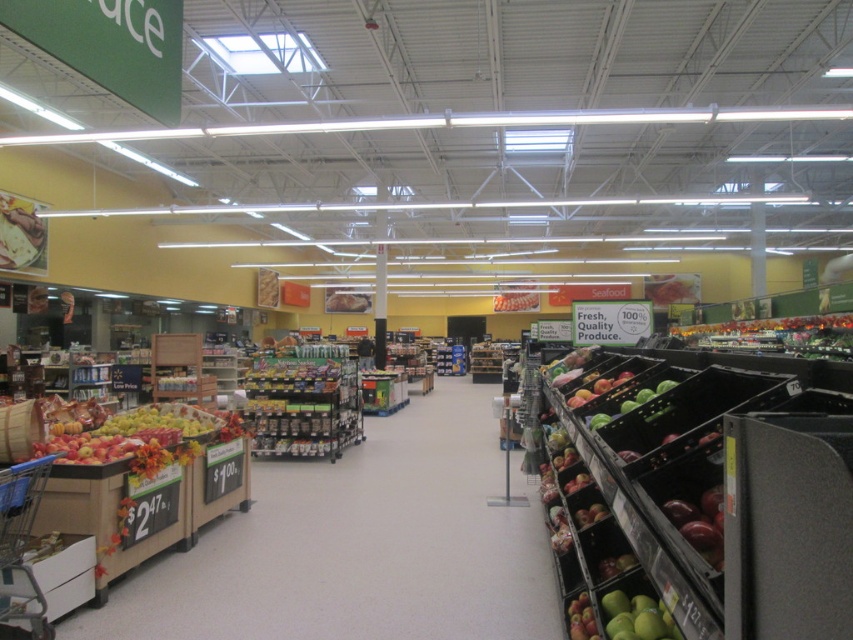
You are standing in the grocery store and see the point marked at coordinates (360, 545). Based on the scene description, what object is this point located on?

The point at coordinates (360, 545) is located on the wooden crate apples at left.

Looking at this image, you are a customer in the grocery store looking for apples. You see a wooden crate apples at left and green matte apples at center. Which one is closer to the entrance of the store?

The wooden crate apples at left is closer to the entrance of the store because it is positioned to the left of the green matte apples at center.